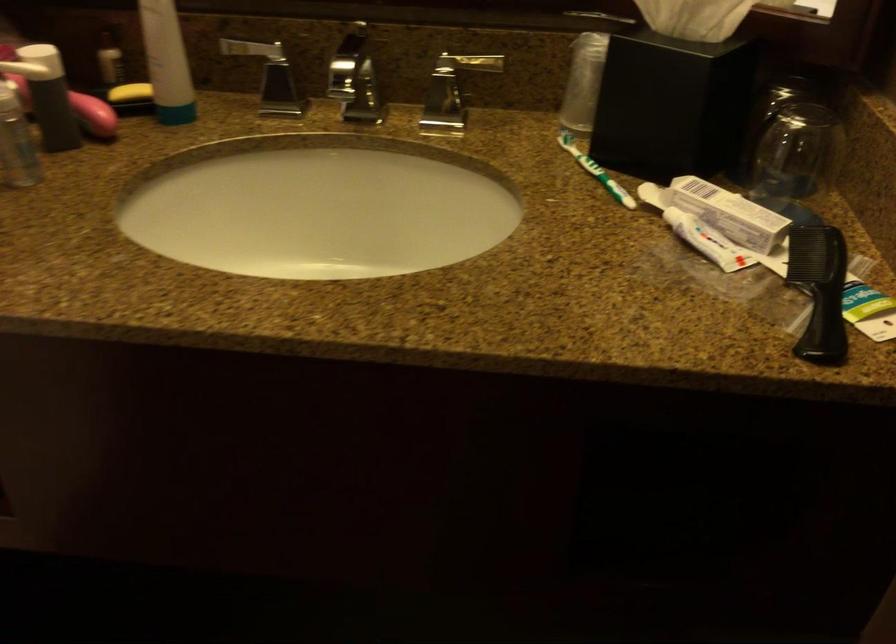
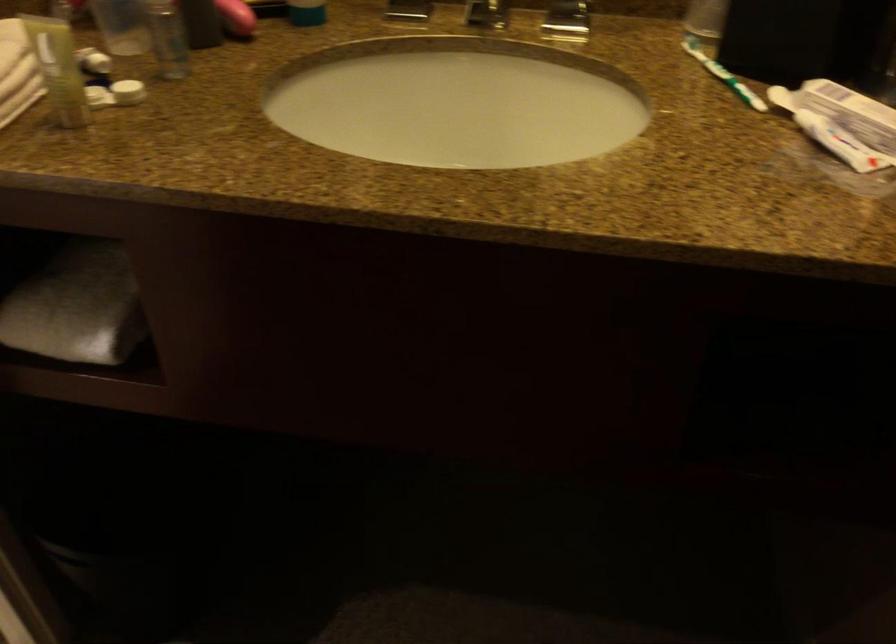
In the second image, find the point that corresponds to point 708,241 in the first image.

(840, 143)